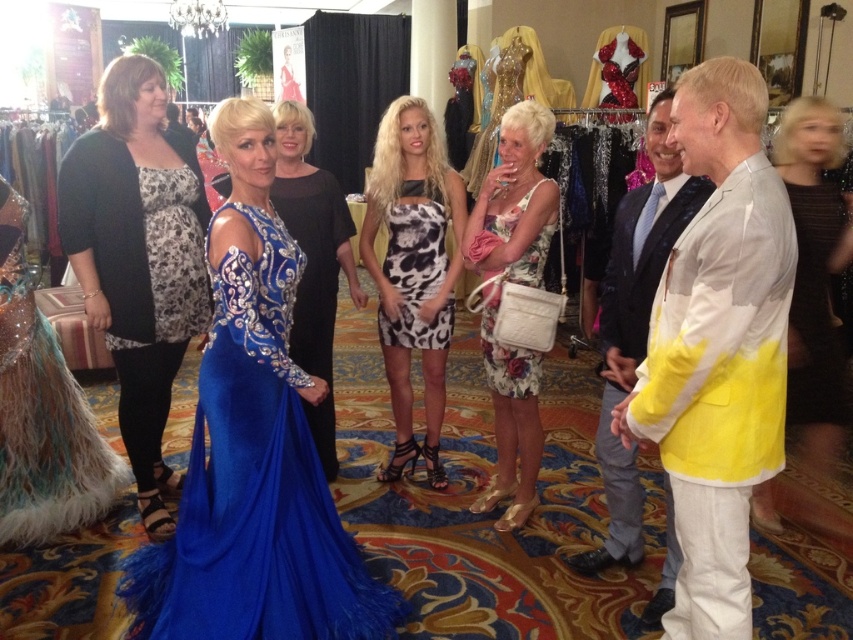
Does brown textured dress at right lie behind floral fabric dress at center?

Yes, brown textured dress at right is further from the viewer.

Is point (767, 500) closer to camera compared to point (502, 371)?

No, it is behind (502, 371).

Is point (805, 232) closer to camera compared to point (512, 205)?

Yes, point (805, 232) is closer to viewer.

This screenshot has height=640, width=853. I want to click on brown textured dress at right, so click(814, 273).

Does printed fabric dress at center appear on the left side of yellow satin suit at right?

Correct, you'll find printed fabric dress at center to the left of yellow satin suit at right.

Based on the photo, how far apart are printed fabric dress at center and yellow satin suit at right?

The distance of printed fabric dress at center from yellow satin suit at right is 36.02 inches.

Is point (393, 355) positioned behind point (613, 477)?

Yes.

The image size is (853, 640). In order to click on printed fabric dress at center in this screenshot , I will do `click(413, 269)`.

What do you see at coordinates (413, 269) in the screenshot? I see `printed fabric dress at center` at bounding box center [413, 269].

Can you confirm if printed fabric dress at center is smaller than blue sequined dress at center?

Incorrect, printed fabric dress at center is not smaller in size than blue sequined dress at center.

What do you see at coordinates (413, 269) in the screenshot? The image size is (853, 640). I see `printed fabric dress at center` at bounding box center [413, 269].

Locate an element on the screen. printed fabric dress at center is located at coordinates (413, 269).